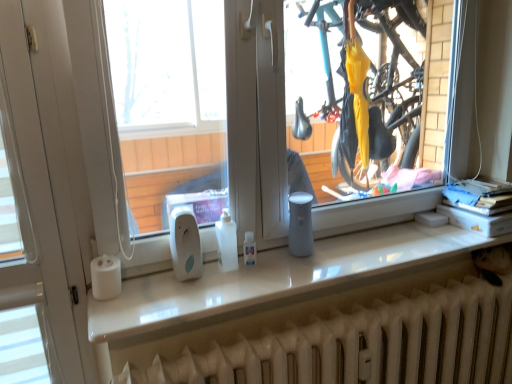
Question: Is white glossy counter top at center wider than white matte paper towel at left?

Choices:
 (A) no
 (B) yes

Answer: (B)

Question: From the image's perspective, would you say white glossy counter top at center is positioned over white matte paper towel at left?

Choices:
 (A) yes
 (B) no

Answer: (A)

Question: Is white glossy counter top at center not near white matte paper towel at left?

Choices:
 (A) yes
 (B) no

Answer: (B)

Question: Considering the relative positions of white glossy counter top at center and white matte paper towel at left in the image provided, is white glossy counter top at center to the left of white matte paper towel at left from the viewer's perspective?

Choices:
 (A) no
 (B) yes

Answer: (A)

Question: Is the position of white glossy counter top at center more distant than that of white matte paper towel at left?

Choices:
 (A) yes
 (B) no

Answer: (B)

Question: Is point (99, 268) closer or farther from the camera than point (498, 324)?

Choices:
 (A) farther
 (B) closer

Answer: (B)

Question: In terms of width, does white matte paper towel at left look wider or thinner when compared to white matte radiator at lower center?

Choices:
 (A) wide
 (B) thin

Answer: (B)

Question: Based on their positions, is white matte paper towel at left located to the left or right of white matte radiator at lower center?

Choices:
 (A) right
 (B) left

Answer: (B)

Question: From a real-world perspective, is white matte paper towel at left above or below white matte radiator at lower center?

Choices:
 (A) above
 (B) below

Answer: (A)

Question: In terms of width, does white matte radiator at lower center look wider or thinner when compared to white matte paper towel at left?

Choices:
 (A) thin
 (B) wide

Answer: (B)

Question: From a real-world perspective, is white matte radiator at lower center above or below white matte paper towel at left?

Choices:
 (A) below
 (B) above

Answer: (A)

Question: From their relative heights in the image, would you say white matte radiator at lower center is taller or shorter than white matte paper towel at left?

Choices:
 (A) tall
 (B) short

Answer: (A)

Question: In the image, is white matte radiator at lower center positioned in front of or behind white matte paper towel at left?

Choices:
 (A) behind
 (B) front

Answer: (B)

Question: Considering the positions of white glossy counter top at center and white matte paper towel at left in the image, is white glossy counter top at center taller or shorter than white matte paper towel at left?

Choices:
 (A) tall
 (B) short

Answer: (B)

Question: In the image, is white glossy counter top at center positioned in front of or behind white matte paper towel at left?

Choices:
 (A) behind
 (B) front

Answer: (B)